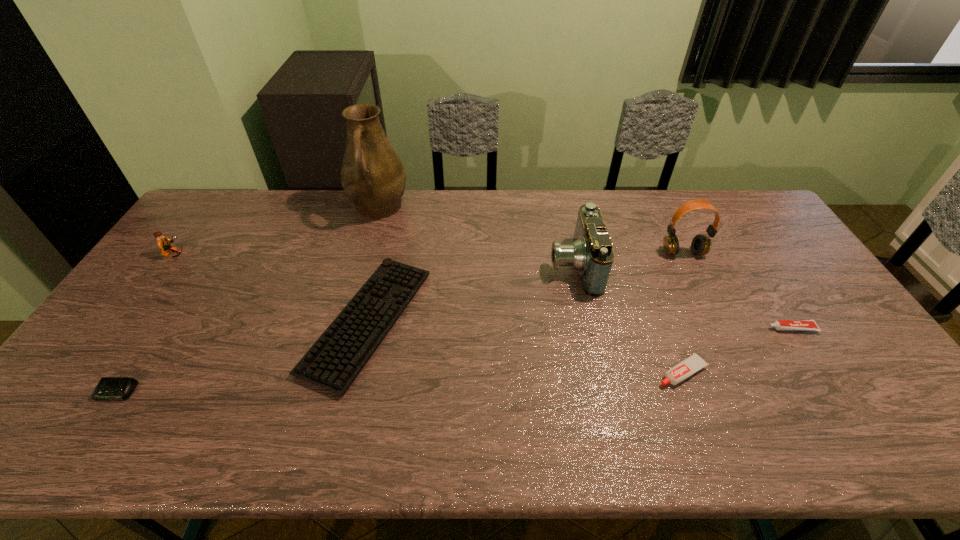
Locate an element on the screen. This screenshot has width=960, height=540. unoccupied position between the tallest object and the Lego is located at coordinates (276, 232).

At what (x,y) coordinates should I click in order to perform the action: click on vacant area between the computer keyboard and the second object from left to right. Please return your answer as a coordinate pair (x, y). This screenshot has height=540, width=960. Looking at the image, I should click on (242, 356).

What are the coordinates of `free space between the computer keyboard and the fifth object from left to right` in the screenshot? It's located at (470, 293).

Where is `empty space that is in between the farthest object and the fourth object from right to left`? empty space that is in between the farthest object and the fourth object from right to left is located at coordinates (476, 237).

Locate which object is the closest to the farthest object. Please provide its 2D coordinates. Your answer should be formatted as a tuple, i.e. [(x, y)], where the tuple contains the x and y coordinates of a point satisfying the conditions above.

[(334, 361)]

Identify which object is located as the sixth nearest to the farthest object. Please provide its 2D coordinates. Your answer should be formatted as a tuple, i.e. [(x, y)], where the tuple contains the x and y coordinates of a point satisfying the conditions above.

[(683, 370)]

I want to click on blank space that satisfies the following two spatial constraints: 1. holding a crossbow in the hands of the left toothpaste; 2. on the left side of the fifth shortest object, so click(90, 372).

You are a GUI agent. You are given a task and a screenshot of the screen. Output one action in this format:
    pyautogui.click(x=<x>, y=<y>)
    Task: Click on the free spot that satisfies the following two spatial constraints: 1. on the front-facing side of the sixth object from left to right; 2. on the right side of the fourth object from right to left
    Image resolution: width=960 pixels, height=540 pixels.
    Given the screenshot: What is the action you would take?
    pyautogui.click(x=596, y=372)

The width and height of the screenshot is (960, 540). Identify the location of free space that satisfies the following two spatial constraints: 1. on the ear cups of the seventh object from left to right; 2. on the front-facing side of the sixth shortest object. (689, 265).